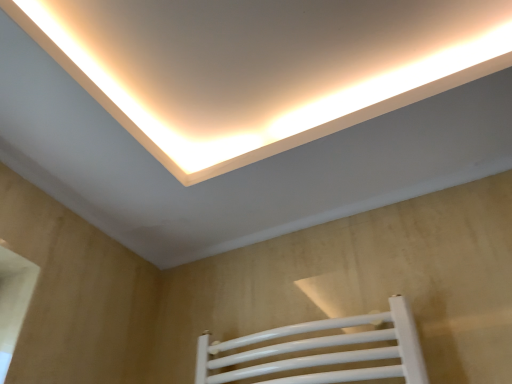
I want to click on white matte ceiling light at upper center, so click(x=262, y=67).

The image size is (512, 384). What do you see at coordinates (262, 67) in the screenshot?
I see `white matte ceiling light at upper center` at bounding box center [262, 67].

In order to face white matte ceiling light at upper center, should I rotate leftwards or rightwards?

To face it directly, rotate left by 1.847 degrees.

Locate an element on the screen. white matte ceiling light at upper center is located at coordinates (262, 67).